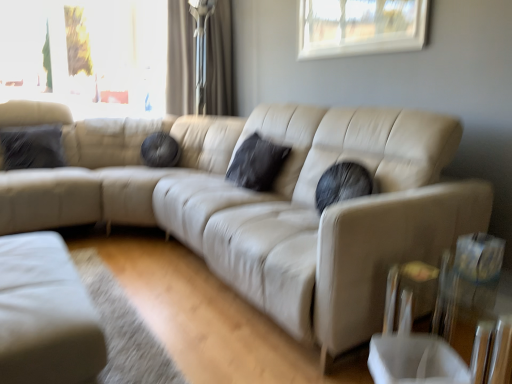
Question: Is velvet dark gray pillow at left, which is the 2th pillow from right to left, surrounded by beige leather couch at center?

Choices:
 (A) no
 (B) yes

Answer: (A)

Question: Is beige leather couch at center not within velvet dark gray pillow at left, which is the 2th pillow from right to left?

Choices:
 (A) yes
 (B) no

Answer: (A)

Question: From a real-world perspective, is beige leather couch at center positioned over velvet dark gray pillow at left, which is the 2th pillow from right to left, based on gravity?

Choices:
 (A) no
 (B) yes

Answer: (A)

Question: Is beige leather couch at center facing away from velvet dark gray pillow at left, the first pillow viewed from the left?

Choices:
 (A) no
 (B) yes

Answer: (A)

Question: Is beige leather couch at center beside velvet dark gray pillow at left, which is the 2th pillow from right to left?

Choices:
 (A) no
 (B) yes

Answer: (A)

Question: Looking at the image, does matte beige curtain at upper center seem bigger or smaller compared to transparent glass window at upper center?

Choices:
 (A) big
 (B) small

Answer: (A)

Question: Looking at their shapes, would you say matte beige curtain at upper center is wider or thinner than transparent glass window at upper center?

Choices:
 (A) wide
 (B) thin

Answer: (A)

Question: Is matte beige curtain at upper center inside the boundaries of transparent glass window at upper center, or outside?

Choices:
 (A) outside
 (B) inside

Answer: (A)

Question: Based on their positions, is matte beige curtain at upper center located to the left or right of transparent glass window at upper center?

Choices:
 (A) right
 (B) left

Answer: (B)

Question: Visually, is beige leather couch at center positioned to the left or to the right of matte beige curtain at upper center?

Choices:
 (A) right
 (B) left

Answer: (A)

Question: From the image's perspective, is beige leather couch at center above or below matte beige curtain at upper center?

Choices:
 (A) above
 (B) below

Answer: (B)

Question: In terms of height, does beige leather couch at center look taller or shorter compared to matte beige curtain at upper center?

Choices:
 (A) tall
 (B) short

Answer: (B)

Question: Considering the positions of beige leather couch at center and matte beige curtain at upper center in the image, is beige leather couch at center bigger or smaller than matte beige curtain at upper center?

Choices:
 (A) small
 (B) big

Answer: (B)

Question: Looking at the image, does black matte pillow at center, the 1th pillow positioned from the right, seem bigger or smaller compared to velvet dark gray pillow at left, which is the 2th pillow from right to left?

Choices:
 (A) big
 (B) small

Answer: (A)

Question: Which is correct: black matte pillow at center, the 2th pillow positioned from the left, is inside velvet dark gray pillow at left, the first pillow viewed from the left, or outside of it?

Choices:
 (A) inside
 (B) outside

Answer: (B)